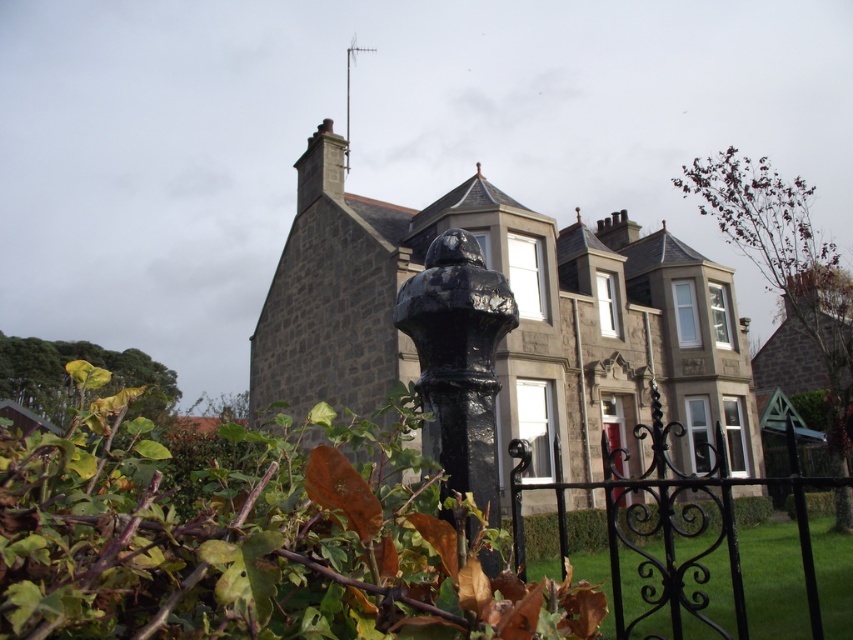
Consider the image. Can you confirm if black wrought iron gate at lower right is wider than glossy black post at center?

Indeed, black wrought iron gate at lower right has a greater width compared to glossy black post at center.

At what (x,y) coordinates should I click in order to perform the action: click on black wrought iron gate at lower right. Please return your answer as a coordinate pair (x, y). Looking at the image, I should click on (672, 524).

What are the coordinates of `black wrought iron gate at lower right` in the screenshot? It's located at pos(672,524).